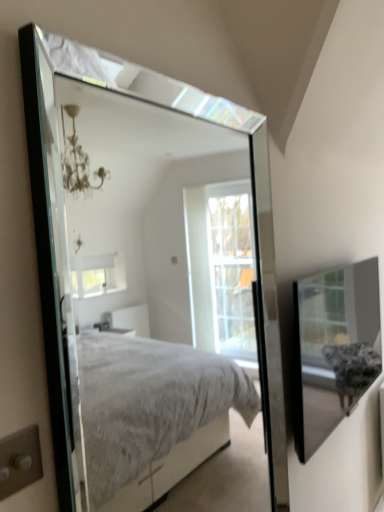
Based on the photo, measure the distance between clear glass box at upper right and camera.

They are 4.59 feet apart.

Describe the element at coordinates (333, 349) in the screenshot. I see `clear glass box at upper right` at that location.

Measure the distance between point (358,292) and camera.

Point (358,292) and camera are 6.82 feet apart.

Where is `clear glass box at upper right`? This screenshot has width=384, height=512. clear glass box at upper right is located at coordinates (333, 349).

In order to face clear glass mirror at upper center, should I rotate leftwards or rightwards?

It's best to rotate right around 1.152 degrees.

What do you see at coordinates (163, 304) in the screenshot? I see `clear glass mirror at upper center` at bounding box center [163, 304].

Where is `clear glass mirror at upper center`? The height and width of the screenshot is (512, 384). clear glass mirror at upper center is located at coordinates (163, 304).

Where is `clear glass box at upper right`? Image resolution: width=384 pixels, height=512 pixels. clear glass box at upper right is located at coordinates (333, 349).

Does clear glass mirror at upper center appear on the right side of clear glass box at upper right?

In fact, clear glass mirror at upper center is to the left of clear glass box at upper right.

Relative to clear glass box at upper right, is clear glass mirror at upper center in front or behind?

clear glass mirror at upper center is in front of clear glass box at upper right.

Is point (245, 311) closer to viewer compared to point (342, 308)?

No, it is behind (342, 308).

From the image's perspective, is clear glass mirror at upper center over clear glass box at upper right?

Yes.

From a real-world perspective, does clear glass mirror at upper center stand above clear glass box at upper right?

Yes, from a real-world perspective, clear glass mirror at upper center is above clear glass box at upper right.

Does clear glass mirror at upper center have a lesser width compared to clear glass box at upper right?

Yes.

Can you confirm if clear glass mirror at upper center is shorter than clear glass box at upper right?

In fact, clear glass mirror at upper center may be taller than clear glass box at upper right.

Is clear glass mirror at upper center bigger or smaller than clear glass box at upper right?

clear glass mirror at upper center is bigger than clear glass box at upper right.

Is clear glass mirror at upper center completely or partially outside of clear glass box at upper right?

Yes, clear glass mirror at upper center is located beyond the bounds of clear glass box at upper right.

Is clear glass mirror at upper center touching clear glass box at upper right?

No.

Is clear glass mirror at upper center facing away from clear glass box at upper right?

No, clear glass box at upper right is not at the back of clear glass mirror at upper center.

How many degrees apart are the facing directions of clear glass mirror at upper center and clear glass box at upper right?

1.1 degrees.

Measure the distance from clear glass mirror at upper center to clear glass box at upper right.

clear glass mirror at upper center is 2.44 meters away from clear glass box at upper right.

Where is `glass box beneath the clear glass mirror at upper center (from a real-world perspective)`? The image size is (384, 512). glass box beneath the clear glass mirror at upper center (from a real-world perspective) is located at coordinates (333, 349).

Does clear glass box at upper right appear on the left side of clear glass mirror at upper center?

In fact, clear glass box at upper right is to the right of clear glass mirror at upper center.

Considering their positions, is clear glass box at upper right located in front of or behind clear glass mirror at upper center?

In the image, clear glass box at upper right appears behind clear glass mirror at upper center.

Does point (294, 361) come behind point (97, 302)?

That is False.

From the image's perspective, which one is positioned lower, clear glass box at upper right or clear glass mirror at upper center?

clear glass box at upper right appears lower in the image.

From a real-world perspective, between clear glass box at upper right and clear glass mirror at upper center, who is vertically higher?

clear glass mirror at upper center, from a real-world perspective.

Considering the sizes of objects clear glass box at upper right and clear glass mirror at upper center in the image provided, who is wider, clear glass box at upper right or clear glass mirror at upper center?

clear glass box at upper right.

Is clear glass box at upper right taller than clear glass mirror at upper center?

In fact, clear glass box at upper right may be shorter than clear glass mirror at upper center.

In the scene shown: Does clear glass box at upper right have a larger size compared to clear glass mirror at upper center?

No.

Is clear glass box at upper right positioned beyond the bounds of clear glass mirror at upper center?

Absolutely, clear glass box at upper right is external to clear glass mirror at upper center.

Are clear glass box at upper right and clear glass mirror at upper center located far from each other?

Yes, clear glass box at upper right and clear glass mirror at upper center are located far from each other.

Is clear glass box at upper right positioned with its back to clear glass mirror at upper center?

No, clear glass box at upper right is not facing away from clear glass mirror at upper center.

Locate an element on the screen. glass box that appears behind the clear glass mirror at upper center is located at coordinates (333, 349).

The height and width of the screenshot is (512, 384). I want to click on mirror located above the clear glass box at upper right (from the image's perspective), so click(163, 304).

Find the location of a particular element. Image resolution: width=384 pixels, height=512 pixels. glass box behind the clear glass mirror at upper center is located at coordinates (333, 349).